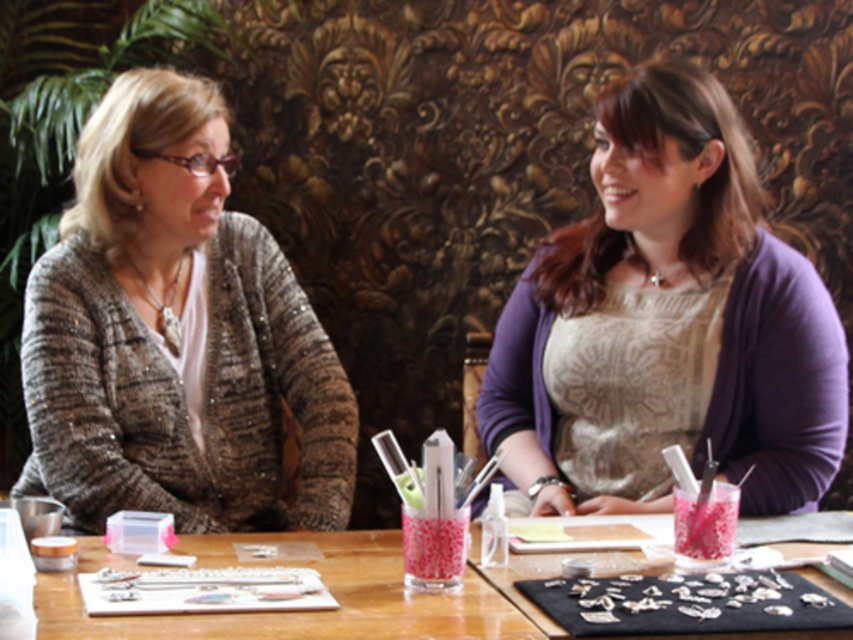
Consider the image. You are a tailor who needs to determine which item requires more fabric for a custom order. Based on the scene, which object between the sparkly gray cardigan at left and the wooden table at center would need more fabric?

The sparkly gray cardigan at left requires more fabric because it is bigger than the wooden table at center.

You are a fashion designer observing the two people in the image. You need to determine which clothing item is positioned higher on the individuals. Which clothing item is located higher between the purple textured sweater at center and the sparkly gray cardigan at left?

The purple textured sweater at center is positioned higher than the sparkly gray cardigan at left according to the description.